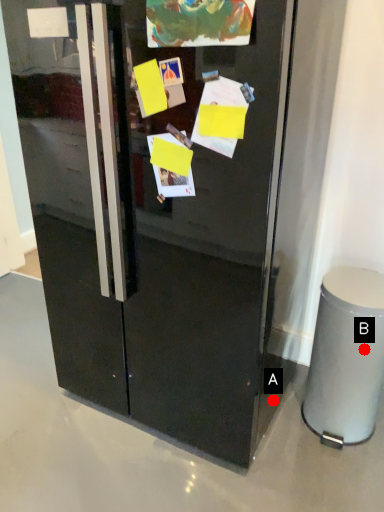
Question: Two points are circled on the image, labeled by A and B beside each circle. Which point appears closest to the camera in this image?

Choices:
 (A) A is closer
 (B) B is closer

Answer: (B)